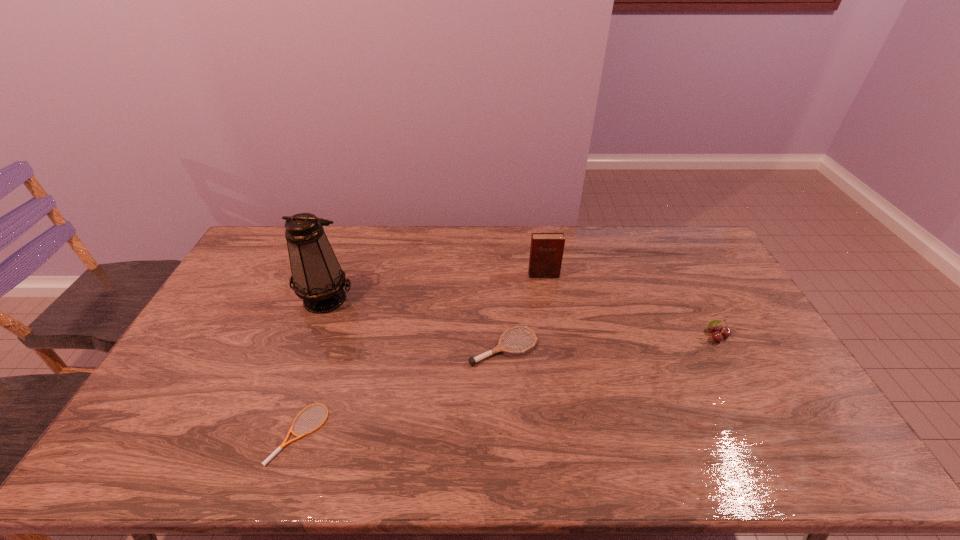
I want to click on the tallest object, so coord(317,278).

This screenshot has width=960, height=540. I want to click on oil lamp, so tap(317, 278).

Identify the location of the farthest object. This screenshot has width=960, height=540. (546, 251).

The width and height of the screenshot is (960, 540). I want to click on the fourth shortest object, so click(546, 251).

Find the location of a particular element. The width and height of the screenshot is (960, 540). cherry is located at coordinates (718, 335).

The height and width of the screenshot is (540, 960). I want to click on the third shortest object, so click(x=718, y=335).

Find the location of a particular element. the fourth tallest object is located at coordinates (500, 347).

At what (x,y) coordinates should I click in order to perform the action: click on the right tennis racket. Please return your answer as a coordinate pair (x, y). Image resolution: width=960 pixels, height=540 pixels. Looking at the image, I should click on (500, 347).

Locate an element on the screen. the shorter tennis racket is located at coordinates (284, 443).

The height and width of the screenshot is (540, 960). I want to click on the left tennis racket, so click(284, 443).